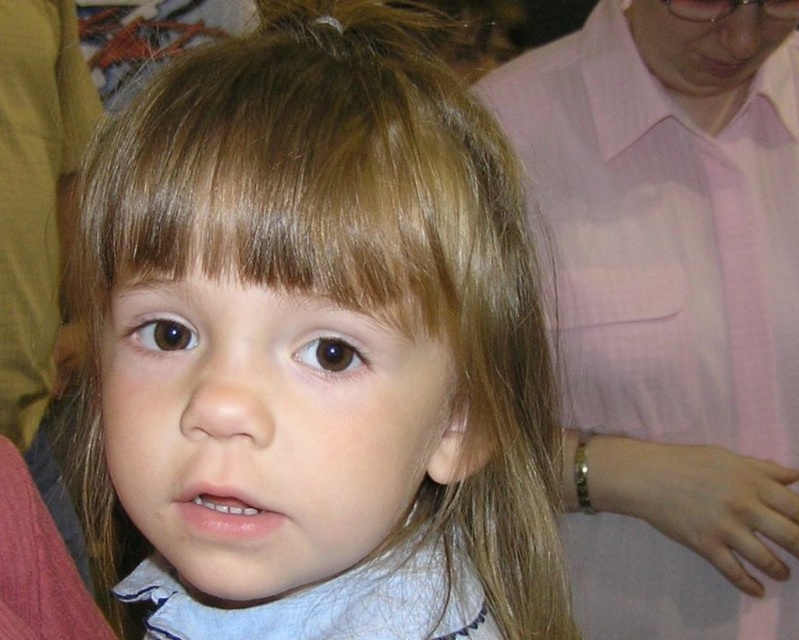
Question: Which point is closer to the camera?

Choices:
 (A) (626, 256)
 (B) (434, 566)

Answer: (B)

Question: Does blonde hair at center have a greater width compared to pink fabric shirt at upper right?

Choices:
 (A) yes
 (B) no

Answer: (B)

Question: Which point is closer to the camera taking this photo?

Choices:
 (A) (499, 545)
 (B) (682, 38)

Answer: (A)

Question: Is blonde hair at center closer to the viewer compared to pink fabric shirt at upper right?

Choices:
 (A) no
 (B) yes

Answer: (B)

Question: Does blonde hair at center appear on the left side of pink fabric shirt at upper right?

Choices:
 (A) no
 (B) yes

Answer: (B)